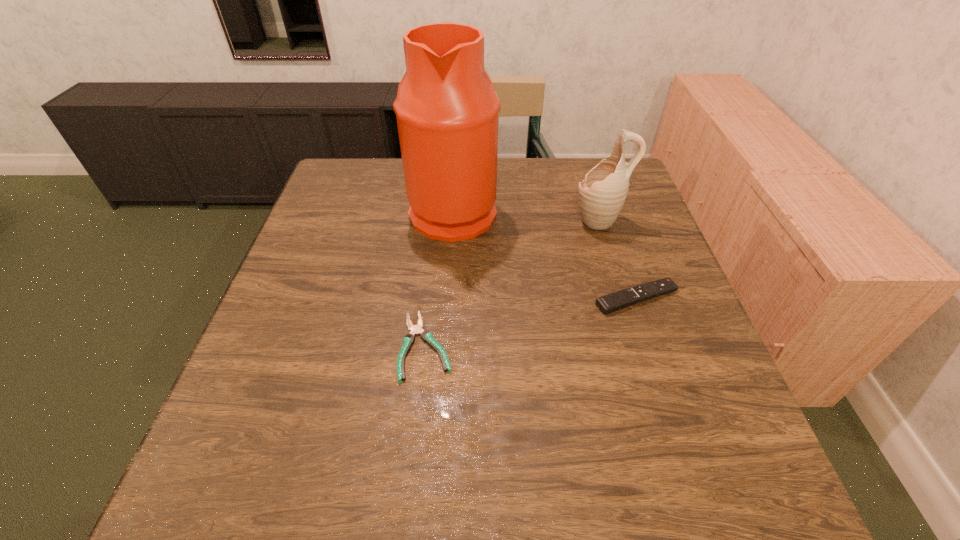
This screenshot has height=540, width=960. What are the coordinates of `object that is at the far edge` in the screenshot? It's located at (447, 110).

At what (x,y) coordinates should I click in order to perform the action: click on pitcher at the right edge. Please return your answer as a coordinate pair (x, y). The height and width of the screenshot is (540, 960). Looking at the image, I should click on (602, 193).

At what (x,y) coordinates should I click in order to perform the action: click on remote control situated at the right edge. Please return your answer as a coordinate pair (x, y). The width and height of the screenshot is (960, 540). Looking at the image, I should click on (624, 298).

Image resolution: width=960 pixels, height=540 pixels. Find the location of `vacant space at the far edge of the desktop`. vacant space at the far edge of the desktop is located at coordinates (404, 179).

In the image, there is a desktop. Find the location of `blank space at the near edge`. blank space at the near edge is located at coordinates (309, 483).

Identify the location of free location at the left edge. The width and height of the screenshot is (960, 540). (329, 217).

This screenshot has height=540, width=960. In order to click on blank space at the right edge in this screenshot , I will do `click(689, 346)`.

At what (x,y) coordinates should I click in order to perform the action: click on free region at the far left corner of the desktop. Please return your answer as a coordinate pair (x, y). This screenshot has height=540, width=960. Looking at the image, I should click on (365, 175).

In the image, there is a desktop. Identify the location of free space at the near left corner. (284, 490).

Locate an element on the screen. free space that is in between the water jug and the pitcher is located at coordinates (526, 215).